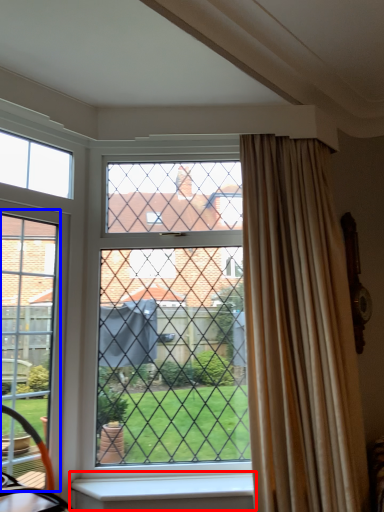
Question: Among these objects, which one is nearest to the camera, window sill (highlighted by a red box) or screen door (highlighted by a blue box)?

Choices:
 (A) window sill
 (B) screen door

Answer: (B)